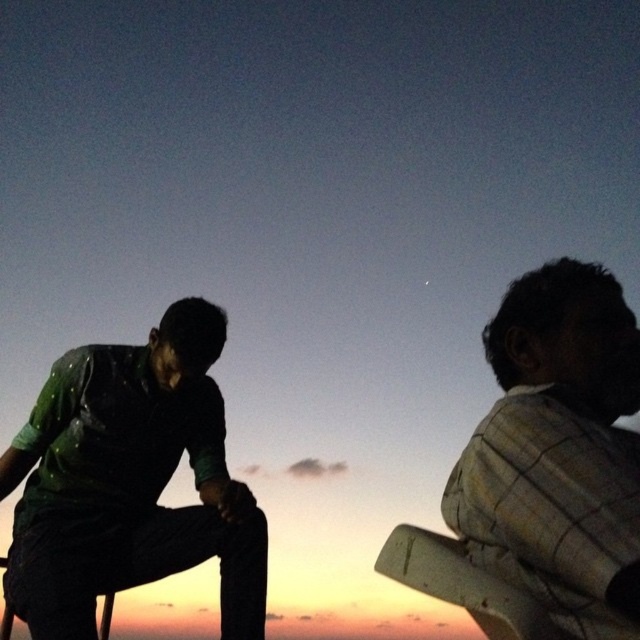
Who is more distant from viewer, (74, 385) or (448, 579)?

The point (74, 385) is behind.

What do you see at coordinates (129, 481) in the screenshot? Image resolution: width=640 pixels, height=640 pixels. I see `green textured pants at left` at bounding box center [129, 481].

The height and width of the screenshot is (640, 640). What are the coordinates of `green textured pants at left` in the screenshot? It's located at (129, 481).

Who is higher up, green textured pants at left or plaid fabric shirt at right?

Positioned higher is plaid fabric shirt at right.

Can you confirm if green textured pants at left is positioned to the left of plaid fabric shirt at right?

Indeed, green textured pants at left is positioned on the left side of plaid fabric shirt at right.

The width and height of the screenshot is (640, 640). Identify the location of green textured pants at left. (129, 481).

Image resolution: width=640 pixels, height=640 pixels. What are the coordinates of `green textured pants at left` in the screenshot? It's located at (129, 481).

Can you confirm if plaid fabric shirt at right is smaller than wooden chair at right?

No.

Which is more to the left, plaid fabric shirt at right or wooden chair at right?

Positioned to the left is wooden chair at right.

Does point (570, 518) come farther from viewer compared to point (488, 628)?

No, (570, 518) is in front of (488, 628).

Image resolution: width=640 pixels, height=640 pixels. Find the location of `plaid fabric shirt at right`. plaid fabric shirt at right is located at coordinates (557, 451).